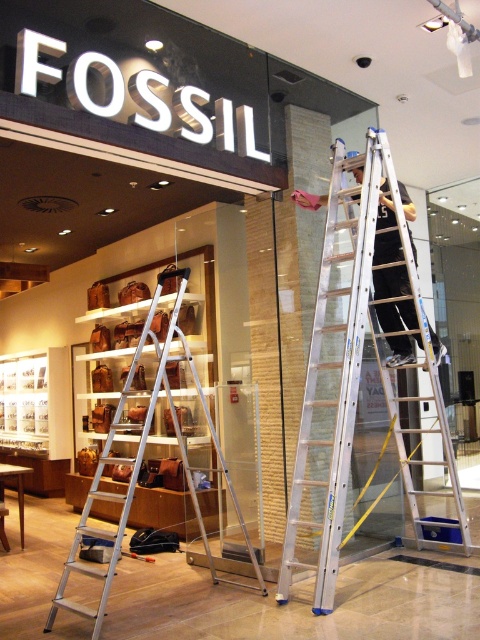
Can you confirm if silver metallic ladder at center is positioned to the right of dark gray fabric pants at center?

Incorrect, silver metallic ladder at center is not on the right side of dark gray fabric pants at center.

Which of these two, silver metallic ladder at center or dark gray fabric pants at center, stands shorter?

With less height is dark gray fabric pants at center.

Identify the location of silver metallic ladder at center. The width and height of the screenshot is (480, 640). (151, 445).

Is point (357, 278) farther from camera compared to point (190, 449)?

No, it is in front of (190, 449).

Which is behind, point (348, 387) or point (112, 518)?

Point (112, 518)

What are the coordinates of `silver metallic ladder at upper right` in the screenshot? It's located at (361, 374).

Locate an element on the screen. The width and height of the screenshot is (480, 640). silver metallic ladder at upper right is located at coordinates (361, 374).

Is silver metallic ladder at upper right shorter than dark gray fabric pants at center?

No.

Between point (444, 352) and point (400, 356), which one is positioned in front?

Positioned in front is point (444, 352).

This screenshot has height=640, width=480. What are the coordinates of `silver metallic ladder at upper right` in the screenshot? It's located at (361, 374).